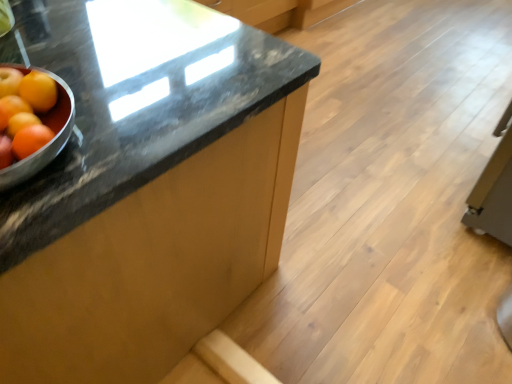
This screenshot has height=384, width=512. Identify the location of vacant space behind orange matte grapefruit at left. (103, 95).